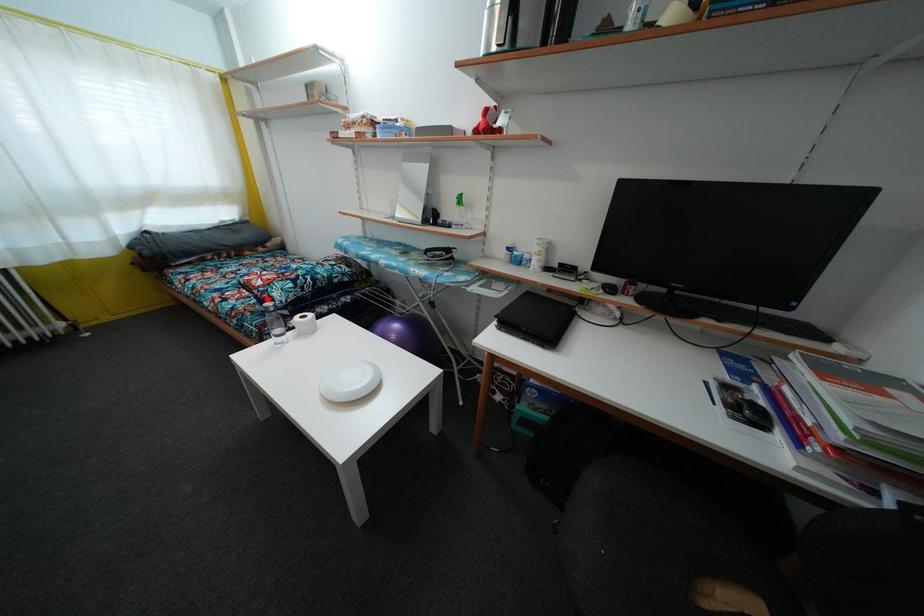
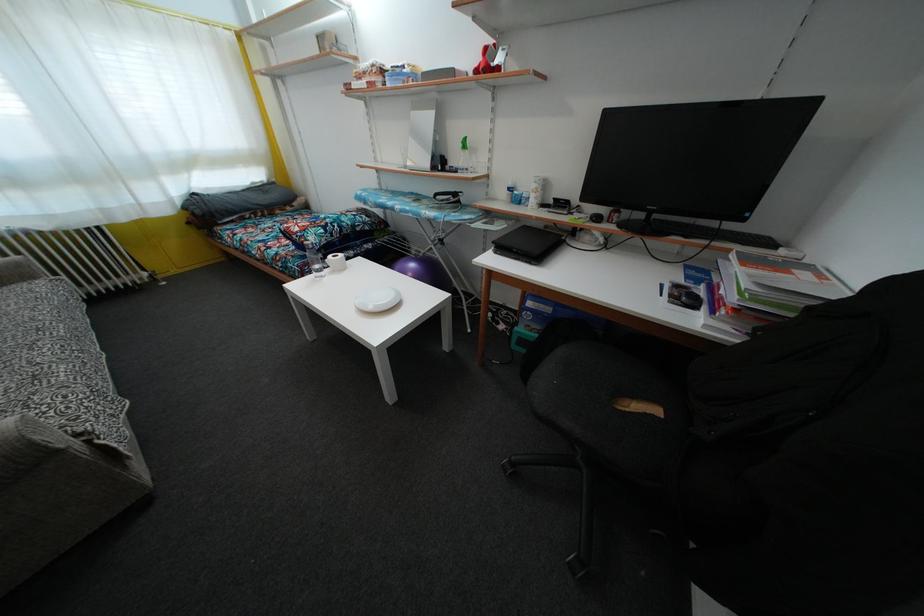
Question: I am providing you with two images of the same scene from different viewpoints. Image1 has a red point marked. In image2, the corresponding 3D location appears at what relative position? Reply with the corresponding letter.

Choices:
 (A) Closer
 (B) Farther

Answer: (A)